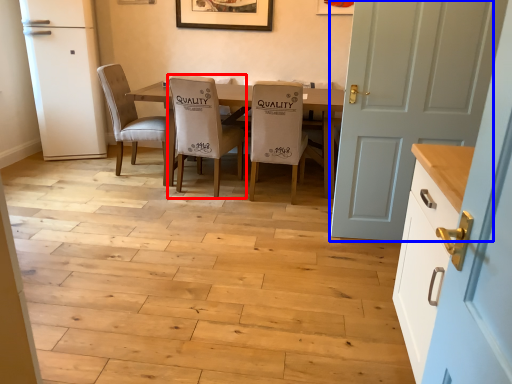
Question: Among these objects, which one is nearest to the camera, chair (highlighted by a red box) or door (highlighted by a blue box)?

Choices:
 (A) chair
 (B) door

Answer: (B)